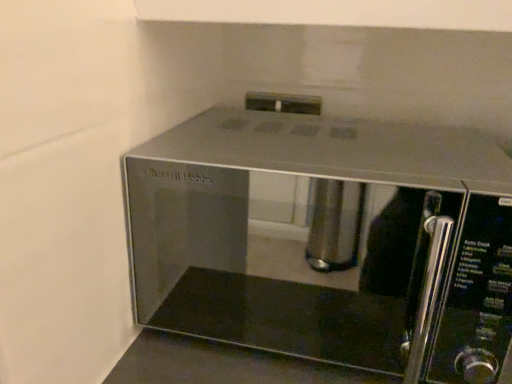
Describe the element at coordinates (325, 242) in the screenshot. The height and width of the screenshot is (384, 512). I see `satin silver microwave at center` at that location.

Where is `satin silver microwave at center`? This screenshot has height=384, width=512. satin silver microwave at center is located at coordinates (325, 242).

Find the location of a particular element. The image size is (512, 384). satin silver microwave at center is located at coordinates (325, 242).